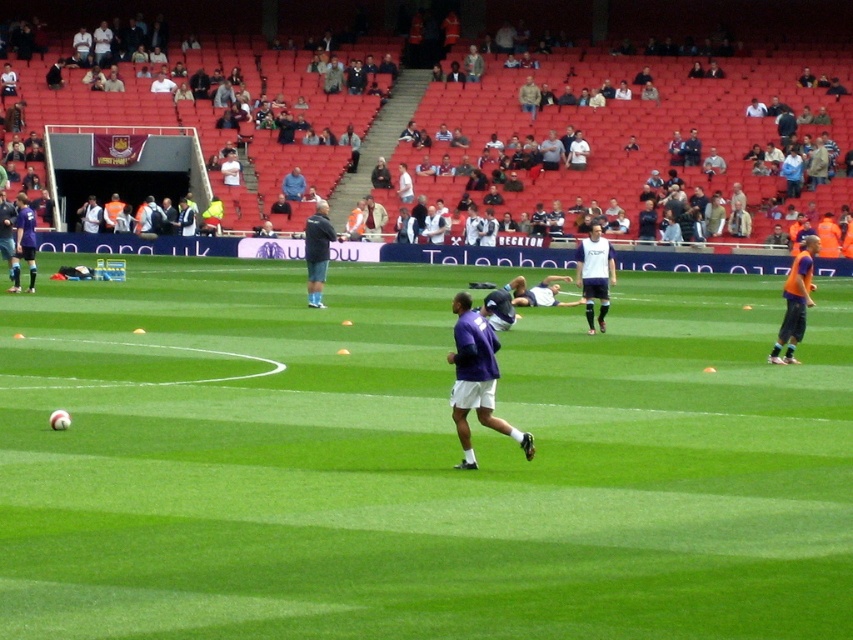
Is purple fabric jacket at center behind white matte jersey at center?

No, purple fabric jacket at center is in front of white matte jersey at center.

Can you confirm if purple fabric jacket at center is positioned above white matte jersey at center?

No.

Between point (479, 396) and point (585, 275), which one is positioned in front?

Point (479, 396) is more forward.

The width and height of the screenshot is (853, 640). Identify the location of purple fabric jacket at center. (476, 380).

Does orange jersey at right have a smaller size compared to dark blue jacket at center?

No, orange jersey at right is not smaller than dark blue jacket at center.

Does orange jersey at right have a lesser width compared to dark blue jacket at center?

No, orange jersey at right is not thinner than dark blue jacket at center.

What do you see at coordinates (795, 301) in the screenshot? This screenshot has height=640, width=853. I see `orange jersey at right` at bounding box center [795, 301].

Find the location of `orange jersey at right`. orange jersey at right is located at coordinates click(795, 301).

Is green grass field at center closer to the viewer compared to purple matte soccer player at left?

Yes, it is in front of purple matte soccer player at left.

Who is taller, green grass field at center or purple matte soccer player at left?

With more height is purple matte soccer player at left.

The width and height of the screenshot is (853, 640). Identify the location of green grass field at center. pyautogui.click(x=416, y=461).

Find the location of a particular element. The height and width of the screenshot is (640, 853). green grass field at center is located at coordinates (416, 461).